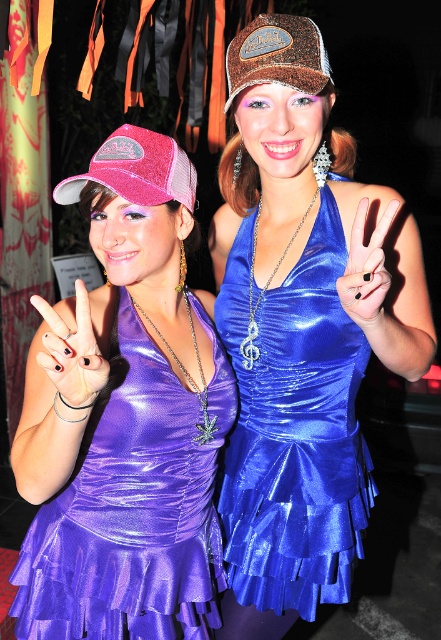
How far apart are pink glitter baseball cap at upper left and glittery brown cap at upper center?

22.76 centimeters

Locate an element on the screen. pink glitter baseball cap at upper left is located at coordinates (137, 170).

Does shiny blue dress at center appear on the right side of glittery brown cap at upper center?

Correct, you'll find shiny blue dress at center to the right of glittery brown cap at upper center.

Is point (354, 397) in front of point (227, 68)?

That is False.

Who is more distant from viewer, (299, 419) or (277, 17)?

The point (299, 419) is behind.

Locate an element on the screen. The image size is (441, 640). shiny blue dress at center is located at coordinates (294, 428).

In the scene shown: Does black matte nails at center have a smaller size compared to black matte hand at center?

No.

Who is higher up, black matte nails at center or black matte hand at center?

black matte hand at center

Does point (33, 301) come farther from viewer compared to point (369, 250)?

No, (33, 301) is closer to viewer.

The image size is (441, 640). Find the location of `black matte nails at center`. black matte nails at center is located at coordinates (70, 353).